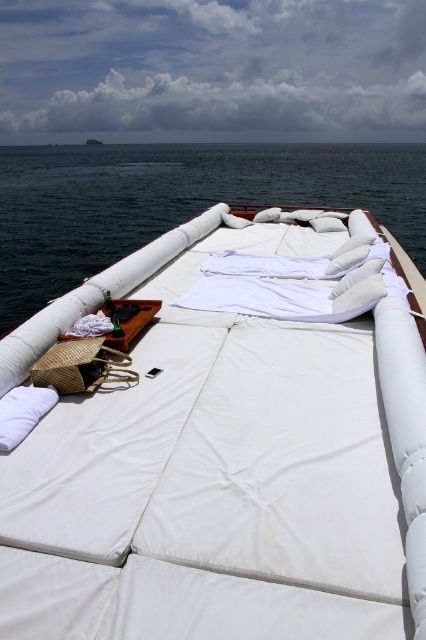
Is the position of white fabric bed at center more distant than that of dark blue water at center?

No.

Does white fabric bed at center lie in front of dark blue water at center?

Yes, it is.

Who is more forward, (187, 573) or (62, 179)?

Point (187, 573) is in front.

I want to click on white fabric bed at center, so click(224, 445).